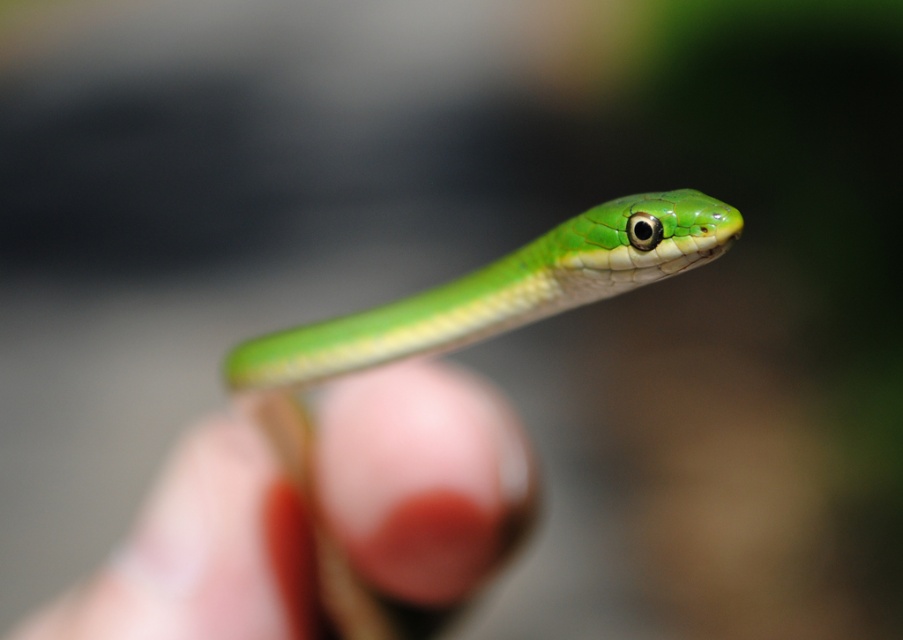
In the scene shown: Does green smooth skin at center have a lesser width compared to green smooth snake at center?

→ Yes, green smooth skin at center is thinner than green smooth snake at center.

Is point (253, 536) farther from camera compared to point (419, 296)?

No, it is not.

You are a GUI agent. You are given a task and a screenshot of the screen. Output one action in this format:
    pyautogui.click(x=<x>, y=<y>)
    Task: Click on the green smooth skin at center
    Image resolution: width=903 pixels, height=640 pixels.
    Given the screenshot: What is the action you would take?
    pyautogui.click(x=424, y=477)